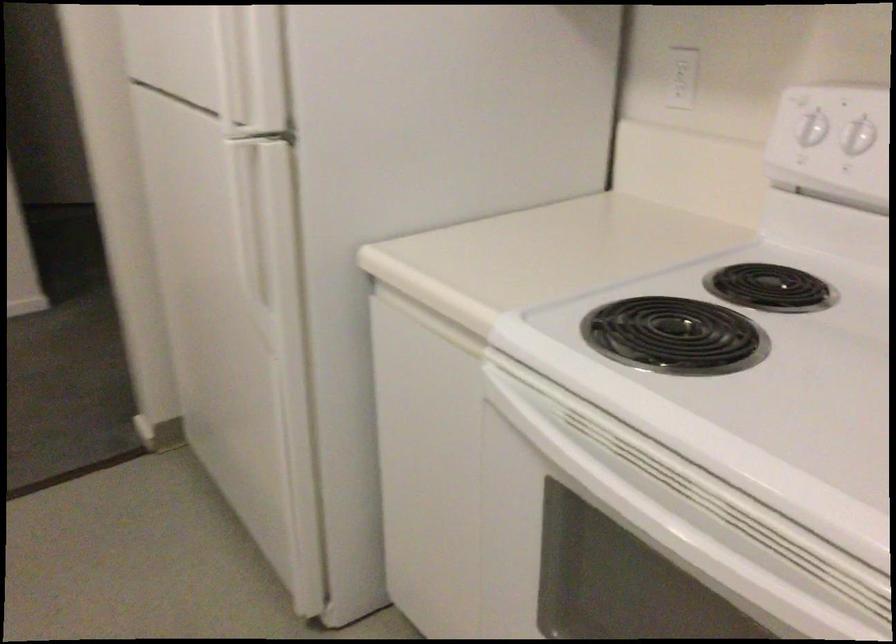
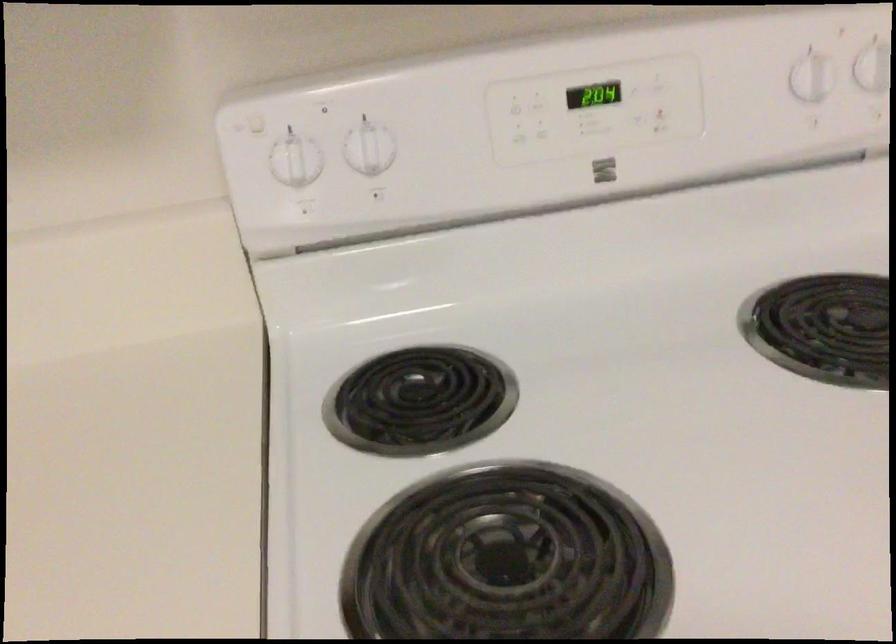
Find the pixel in the second image that matches point 803,117 in the first image.

(295, 160)